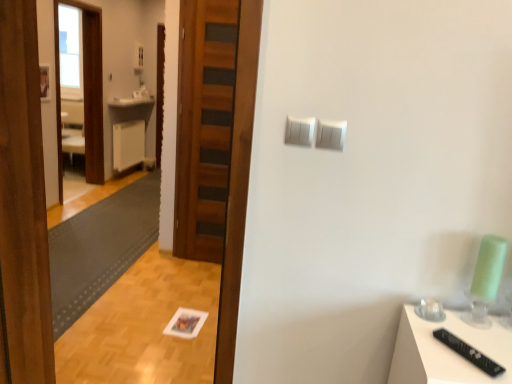
Where is `blank area beneath dark gray textured mat at lower left (from a real-world perspective)`? This screenshot has width=512, height=384. blank area beneath dark gray textured mat at lower left (from a real-world perspective) is located at coordinates (109, 226).